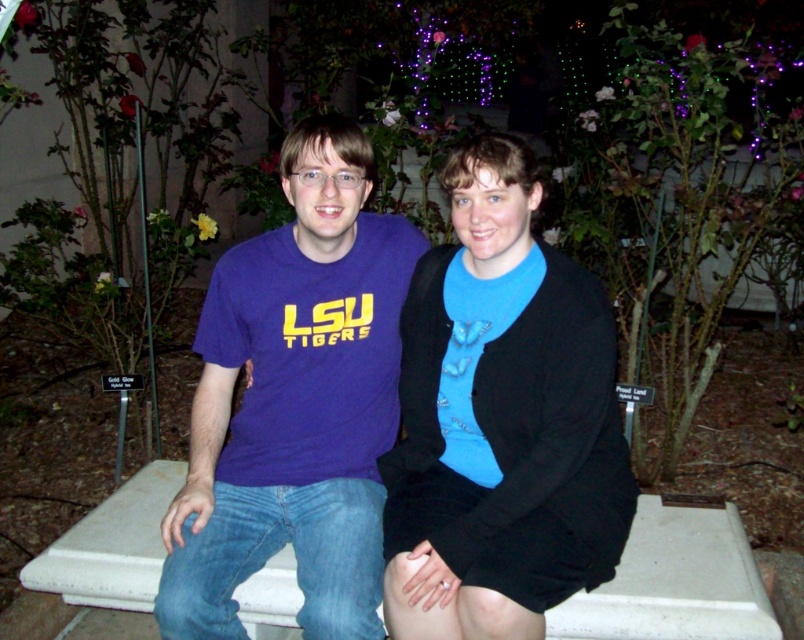
Question: Which object is closer to the camera taking this photo?

Choices:
 (A) matte purple t-shirt at center
 (B) blue matte sweater at center

Answer: (B)

Question: Does blue matte sweater at center have a larger size compared to matte purple t-shirt at center?

Choices:
 (A) yes
 (B) no

Answer: (B)

Question: Does blue matte sweater at center appear over matte purple t-shirt at center?

Choices:
 (A) no
 (B) yes

Answer: (A)

Question: Which point is closer to the camera?

Choices:
 (A) matte purple t-shirt at center
 (B) blue matte sweater at center

Answer: (B)

Question: Where is blue matte sweater at center located in relation to matte purple t-shirt at center in the image?

Choices:
 (A) left
 (B) right

Answer: (B)